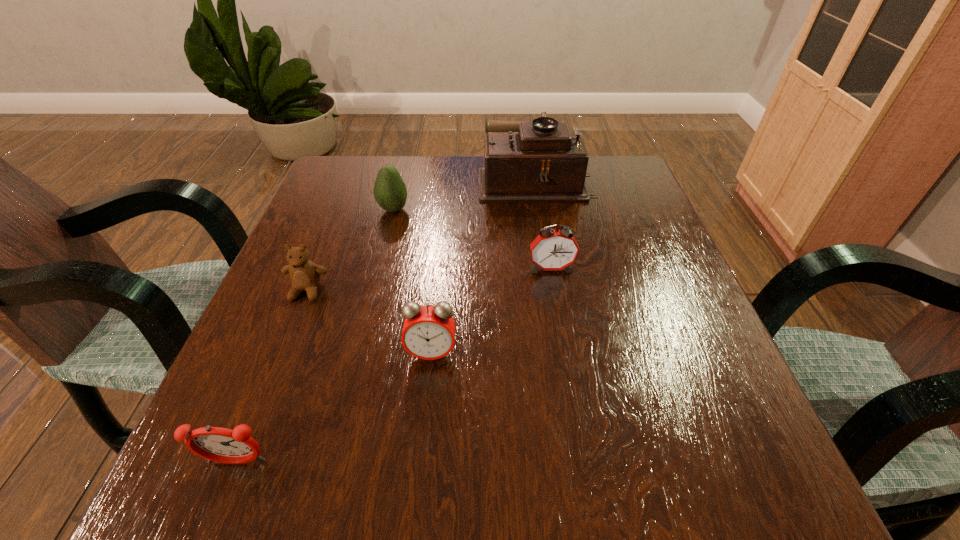
Where is `teddy bear at the left edge`? The height and width of the screenshot is (540, 960). teddy bear at the left edge is located at coordinates (305, 275).

At what (x,y) coordinates should I click in order to perform the action: click on alarm clock at the left edge. Please return your answer as a coordinate pair (x, y). This screenshot has width=960, height=540. Looking at the image, I should click on (217, 444).

I want to click on object that is at the right edge, so click(x=540, y=161).

Find the location of a particular element. object that is at the far left corner is located at coordinates (390, 192).

Identify the location of object that is positioned at the near left corner. Image resolution: width=960 pixels, height=540 pixels. (217, 444).

Locate an element on the screen. The height and width of the screenshot is (540, 960). object that is at the far right corner is located at coordinates pos(540,161).

In order to click on vacant region at the far edge in this screenshot , I will do `click(414, 159)`.

Where is `free region at the left edge of the desktop`? free region at the left edge of the desktop is located at coordinates (349, 233).

The image size is (960, 540). I want to click on free space at the right edge, so click(x=685, y=277).

This screenshot has height=540, width=960. I want to click on blank area at the near left corner, so click(x=227, y=492).